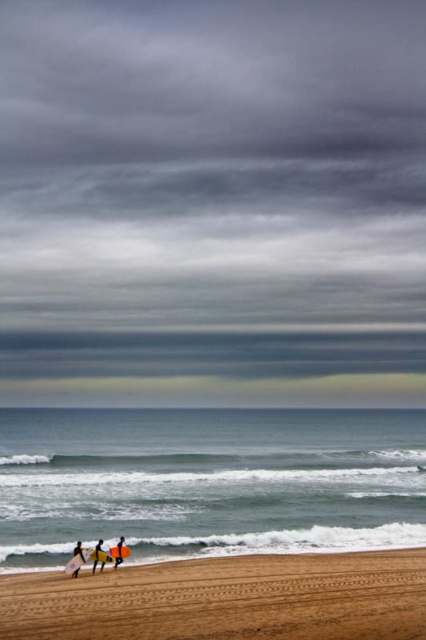
Question: Does brown sandy beach at lower center have a larger size compared to smooth yellow surfboard at lower left?

Choices:
 (A) no
 (B) yes

Answer: (B)

Question: Which of the following is the closest to the observer?

Choices:
 (A) (245, 358)
 (B) (175, 608)
 (C) (98, 557)
 (D) (80, 556)

Answer: (B)

Question: Is gray cloudy sky at upper center behind brown sandy beach at lower center?

Choices:
 (A) yes
 (B) no

Answer: (A)

Question: Is brown sandy beach at lower center above yellow fabric surfboard at lower left?

Choices:
 (A) no
 (B) yes

Answer: (B)

Question: Which object is closer to the camera taking this photo?

Choices:
 (A) brown sandy beach at lower center
 (B) yellow foam surfboard at lower center

Answer: (A)

Question: Which object is positioned closest to the gray cloudy sky at upper center?

Choices:
 (A) brown sandy beach at lower center
 (B) smooth yellow surfboard at lower left
 (C) yellow fabric surfboard at lower left

Answer: (A)